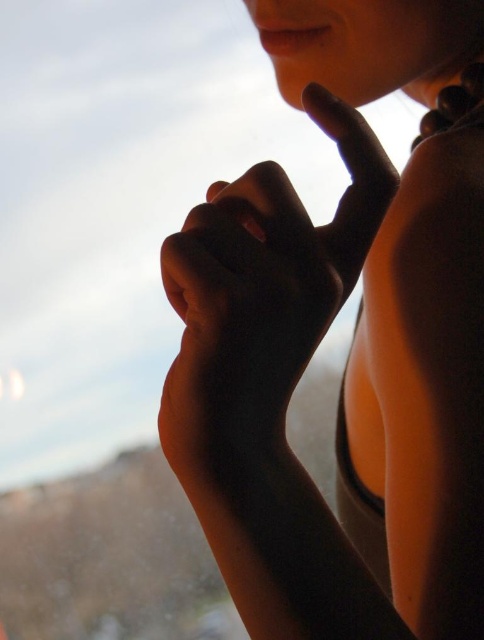
You are taking a photo of two points in the image. The first point is at coordinates point (x=230, y=356) and the second point is at point (x=191, y=451). Which point will appear larger in your photo?

Point (x=230, y=356) is closer to the camera than point (x=191, y=451), so it will appear larger in the photo.

You are a photographer trying to capture the perfect shot of the person in the image. You need to ensure that both the smooth skin at center and the smooth skin hand at center are in focus. Given that your camera can only focus on objects within a 4 inch range, will both areas be in focus?

The distance between the smooth skin at center and the smooth skin hand at center is 3.91 inches, which is within the camera focus range of 4 inches. Therefore, both areas will be in focus.

You are a photographer adjusting the focus of your camera. The subject is making a gesture with their right hand, and you need to ensure the smooth skin at center is in focus. Based on the scene description, where should you aim the focus point?

You should aim the focus point at the coordinates point (352, 339) where the smooth skin at center is located.